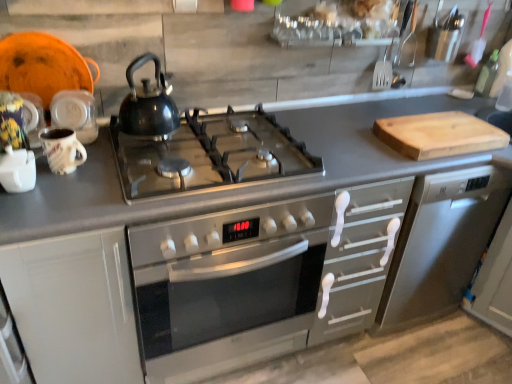
Find the location of a particular element. free location in front of white matte coffee cup at left, which is the 2th appliance from top to bottom is located at coordinates pos(20,217).